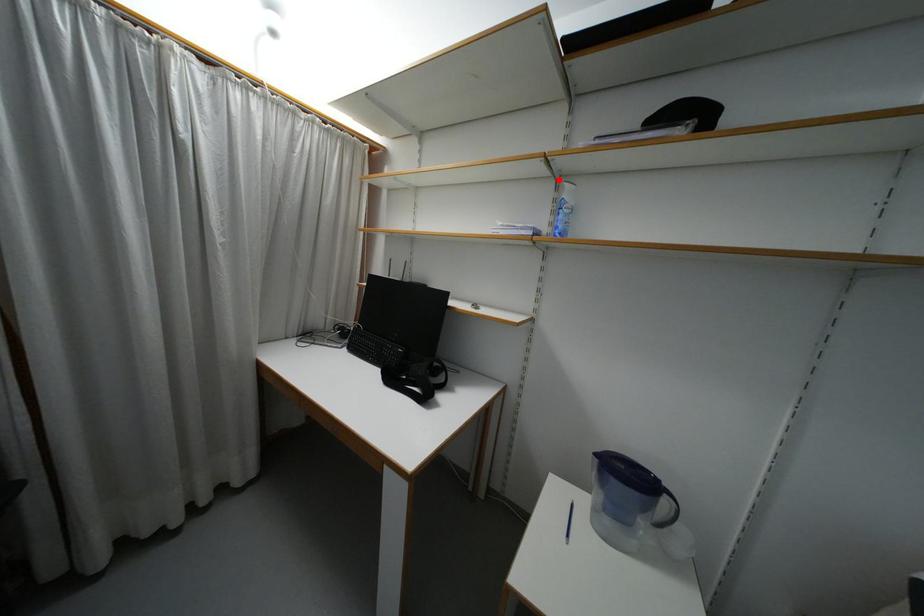
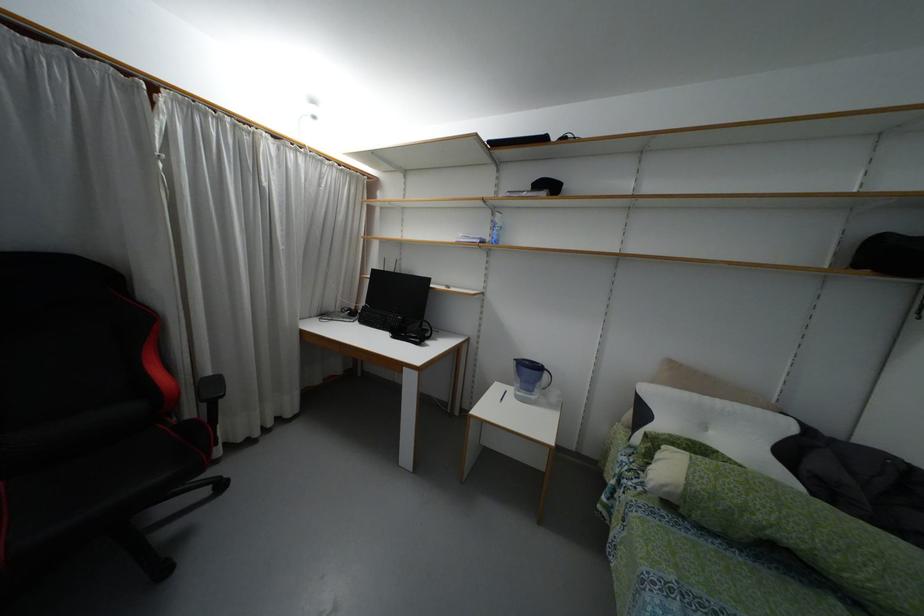
Find the pixel in the second image that matches the highlighted location in the first image.

(493, 209)